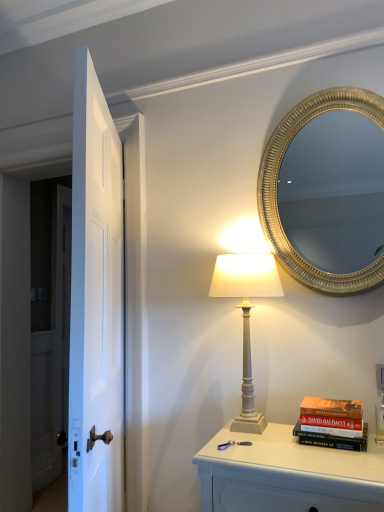
Question: Is white matte table lamp at center situated inside white glossy door at left or outside?

Choices:
 (A) inside
 (B) outside

Answer: (B)

Question: Is white matte table lamp at center wider or thinner than white glossy door at left?

Choices:
 (A) thin
 (B) wide

Answer: (B)

Question: Estimate the real-world distances between objects in this image. Which object is closer to the white painted wood nightstand at lower right?

Choices:
 (A) gold textured mirror at upper right
 (B) white glossy door at left
 (C) white matte table lamp at center
 (D) hardcover book at right

Answer: (D)

Question: Estimate the real-world distances between objects in this image. Which object is closer to the white painted wood nightstand at lower right?

Choices:
 (A) white glossy door at left
 (B) white matte table lamp at center
 (C) hardcover book at right
 (D) gold textured mirror at upper right

Answer: (C)